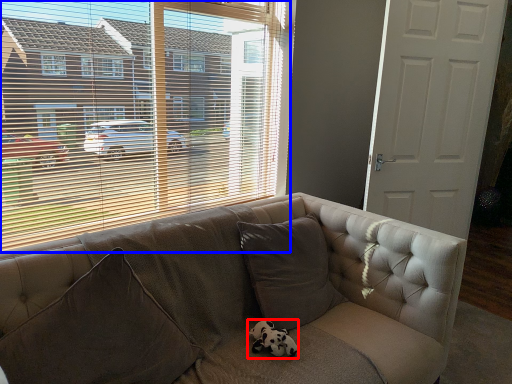
Question: Which object appears farthest to the camera in this image, animal (highlighted by a red box) or window (highlighted by a blue box)?

Choices:
 (A) animal
 (B) window

Answer: (A)